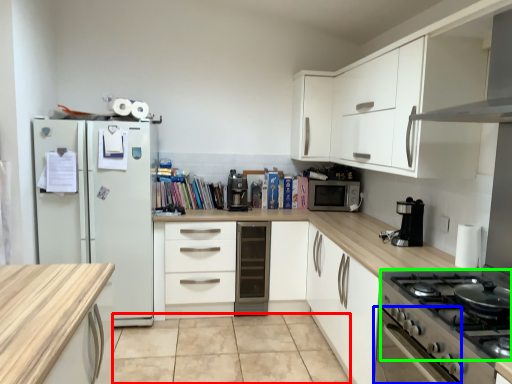
Question: Which is farther away from tile (highlighted by a red box)? oven (highlighted by a blue box) or gas stove (highlighted by a green box)?

Choices:
 (A) oven
 (B) gas stove

Answer: (B)